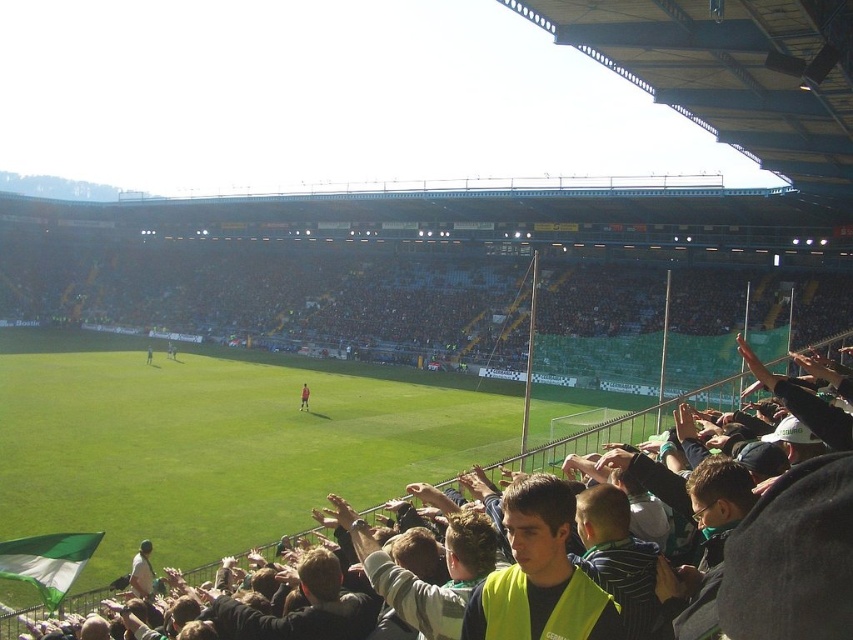
Who is more forward, (49, 560) or (142, 561)?

Point (49, 560) is more forward.

Does point (80, 566) lie behind point (132, 588)?

No, (80, 566) is closer to viewer.

This screenshot has width=853, height=640. Find the location of `yellow-green jersey at lower center`. yellow-green jersey at lower center is located at coordinates (47, 557).

Between light brown leather jacket at lower left and dark green jersey at center, which one has more height?

dark green jersey at center is taller.

Is point (141, 547) positioned before point (308, 396)?

Yes, it is in front of point (308, 396).

Which is in front, point (134, 556) or point (306, 408)?

Point (134, 556)

Where is `light brown leather jacket at lower left`? The image size is (853, 640). light brown leather jacket at lower left is located at coordinates (142, 572).

Does point (16, 547) come farther from viewer compared to point (303, 390)?

No, it is in front of (303, 390).

In the scene shown: Can you confirm if yellow-green jersey at lower center is thinner than dark green jersey at center?

Answer: No, yellow-green jersey at lower center is not thinner than dark green jersey at center.

This screenshot has width=853, height=640. What do you see at coordinates (47, 557) in the screenshot? I see `yellow-green jersey at lower center` at bounding box center [47, 557].

The width and height of the screenshot is (853, 640). I want to click on yellow-green jersey at lower center, so click(x=47, y=557).